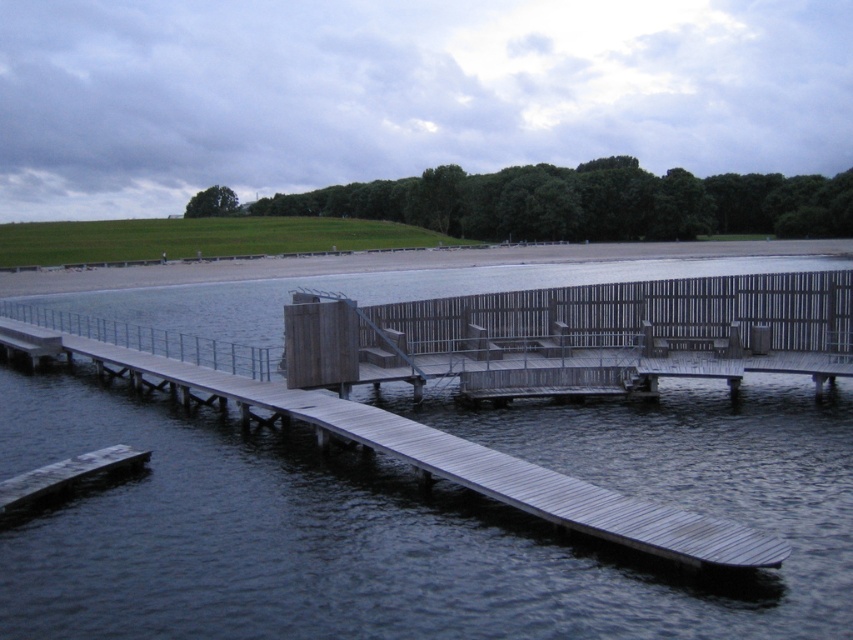
Does wooden dock at center have a smaller size compared to smooth wooden dock at lower left?

Actually, wooden dock at center might be larger than smooth wooden dock at lower left.

Is wooden dock at center thinner than smooth wooden dock at lower left?

In fact, wooden dock at center might be wider than smooth wooden dock at lower left.

The width and height of the screenshot is (853, 640). In order to click on wooden dock at center in this screenshot , I will do `click(440, 456)`.